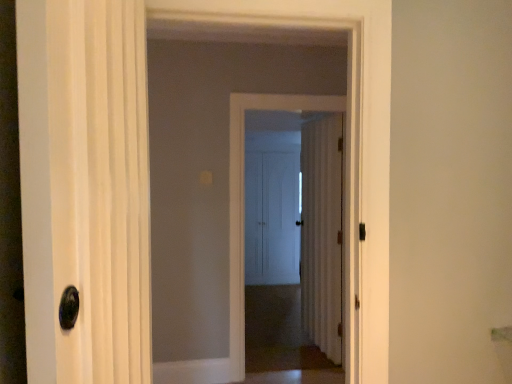
Question: Is white matte door at center, arranged as the 1th door when viewed from the back, taller than brown carpet at center?

Choices:
 (A) yes
 (B) no

Answer: (A)

Question: Is white matte door at center, arranged as the 1th door when viewed from the back, placed right next to brown carpet at center?

Choices:
 (A) no
 (B) yes

Answer: (A)

Question: Is white matte door at center, the fourth door from the front, not within brown carpet at center?

Choices:
 (A) yes
 (B) no

Answer: (A)

Question: Is white matte door at center, arranged as the 1th door when viewed from the back, further to camera compared to brown carpet at center?

Choices:
 (A) yes
 (B) no

Answer: (A)

Question: From a real-world perspective, does white matte door at center, arranged as the 1th door when viewed from the back, sit lower than brown carpet at center?

Choices:
 (A) no
 (B) yes

Answer: (A)

Question: Is white glossy door at left, the fourth door in the back-to-front sequence, spatially inside white wood door at center, which is counted as the 2th door, starting from the back, or outside of it?

Choices:
 (A) outside
 (B) inside

Answer: (A)

Question: Is white glossy door at left, the fourth door in the back-to-front sequence, taller or shorter than white wood door at center, which is counted as the 2th door, starting from the back?

Choices:
 (A) short
 (B) tall

Answer: (A)

Question: In terms of size, does white glossy door at left, the 1th door in the front-to-back sequence, appear bigger or smaller than white wood door at center, acting as the 3th door starting from the front?

Choices:
 (A) big
 (B) small

Answer: (A)

Question: Visually, is white glossy door at left, the 1th door in the front-to-back sequence, positioned to the left or to the right of white wood door at center, which is counted as the 2th door, starting from the back?

Choices:
 (A) left
 (B) right

Answer: (A)

Question: From a real-world perspective, is white matte door at center, which appears as the second door when viewed from the front, above or below white wood door at center, acting as the 3th door starting from the front?

Choices:
 (A) above
 (B) below

Answer: (A)

Question: Is point (231, 349) closer or farther from the camera than point (307, 195)?

Choices:
 (A) closer
 (B) farther

Answer: (A)

Question: From the image's perspective, is white matte door at center, which appears as the second door when viewed from the front, located above or below white wood door at center, which is counted as the 2th door, starting from the back?

Choices:
 (A) below
 (B) above

Answer: (B)

Question: Relative to white wood door at center, acting as the 3th door starting from the front, is white matte door at center, which appears as the second door when viewed from the front, in front or behind?

Choices:
 (A) front
 (B) behind

Answer: (A)

Question: From the image's perspective, is white glossy door at center above or below brown carpet at center?

Choices:
 (A) below
 (B) above

Answer: (B)

Question: From a real-world perspective, is white glossy door at center above or below brown carpet at center?

Choices:
 (A) below
 (B) above

Answer: (B)